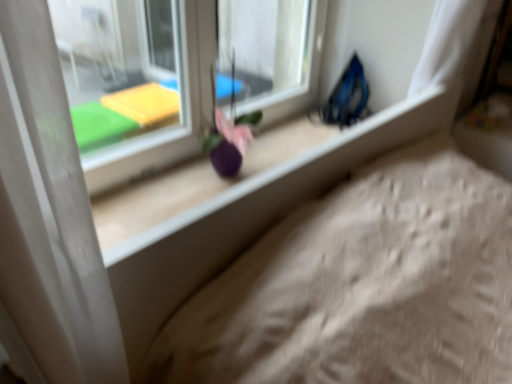
Question: In terms of size, does matte plastic window at center appear bigger or smaller than purple matte flower at center?

Choices:
 (A) big
 (B) small

Answer: (A)

Question: Is matte plastic window at center situated inside purple matte flower at center or outside?

Choices:
 (A) inside
 (B) outside

Answer: (B)

Question: Is point (303, 3) closer or farther from the camera than point (259, 112)?

Choices:
 (A) farther
 (B) closer

Answer: (A)

Question: Is purple matte flower at center bigger or smaller than matte plastic window at center?

Choices:
 (A) big
 (B) small

Answer: (B)

Question: From a real-world perspective, is purple matte flower at center positioned above or below matte plastic window at center?

Choices:
 (A) below
 (B) above

Answer: (A)

Question: Is purple matte flower at center in front of or behind matte plastic window at center in the image?

Choices:
 (A) front
 (B) behind

Answer: (B)

Question: Considering the relative positions of purple matte flower at center and matte plastic window at center in the image provided, is purple matte flower at center to the left or to the right of matte plastic window at center?

Choices:
 (A) right
 (B) left

Answer: (A)